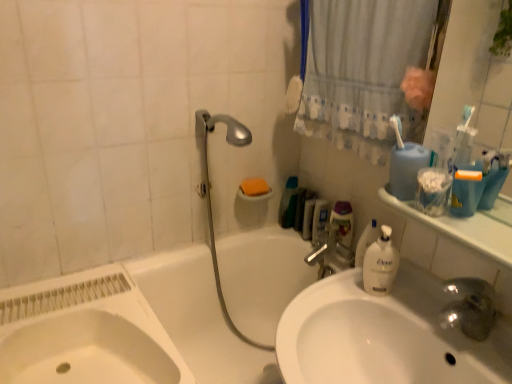
The height and width of the screenshot is (384, 512). Identify the location of vacant area that is in front of orange matte cup at right, placed as the first mouthwash when sorted from front to back. (481, 238).